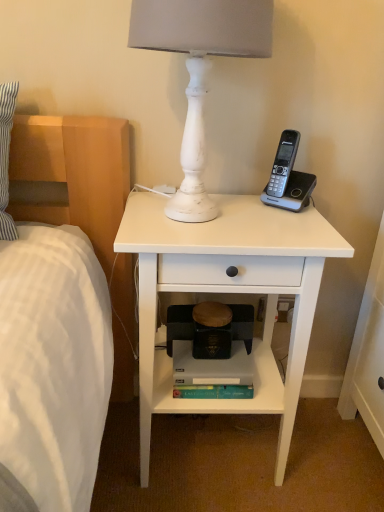
Question: From a real-world perspective, is white matte nightstand at center positioned over wooden step stool at center based on gravity?

Choices:
 (A) yes
 (B) no

Answer: (A)

Question: Can you confirm if white matte nightstand at center is thinner than wooden step stool at center?

Choices:
 (A) yes
 (B) no

Answer: (B)

Question: Are white matte nightstand at center and wooden step stool at center beside each other?

Choices:
 (A) no
 (B) yes

Answer: (A)

Question: Could you tell me if white matte nightstand at center is facing wooden step stool at center?

Choices:
 (A) yes
 (B) no

Answer: (A)

Question: Is white matte nightstand at center positioned in front of wooden step stool at center?

Choices:
 (A) no
 (B) yes

Answer: (B)

Question: In the image, is white matte nightstand at center on the left side or the right side of wooden step stool at center?

Choices:
 (A) left
 (B) right

Answer: (B)

Question: Looking at their shapes, would you say white matte nightstand at center is wider or thinner than wooden step stool at center?

Choices:
 (A) wide
 (B) thin

Answer: (A)

Question: Considering their positions, is white matte nightstand at center located in front of or behind wooden step stool at center?

Choices:
 (A) behind
 (B) front

Answer: (B)

Question: From a real-world perspective, is white matte nightstand at center positioned above or below wooden step stool at center?

Choices:
 (A) above
 (B) below

Answer: (A)

Question: Considering the positions of point (276, 409) and point (193, 327), is point (276, 409) closer or farther from the camera than point (193, 327)?

Choices:
 (A) farther
 (B) closer

Answer: (B)

Question: Looking at their shapes, would you say gray matte bookshelf at lower center is wider or thinner than wooden step stool at center?

Choices:
 (A) thin
 (B) wide

Answer: (B)

Question: In terms of height, does gray matte bookshelf at lower center look taller or shorter compared to wooden step stool at center?

Choices:
 (A) short
 (B) tall

Answer: (A)

Question: Is gray matte bookshelf at lower center bigger or smaller than wooden step stool at center?

Choices:
 (A) big
 (B) small

Answer: (B)

Question: From a real-world perspective, is white distressed wood lamp at upper center positioned above or below wooden step stool at center?

Choices:
 (A) below
 (B) above

Answer: (B)

Question: Is white distressed wood lamp at upper center bigger or smaller than wooden step stool at center?

Choices:
 (A) small
 (B) big

Answer: (B)